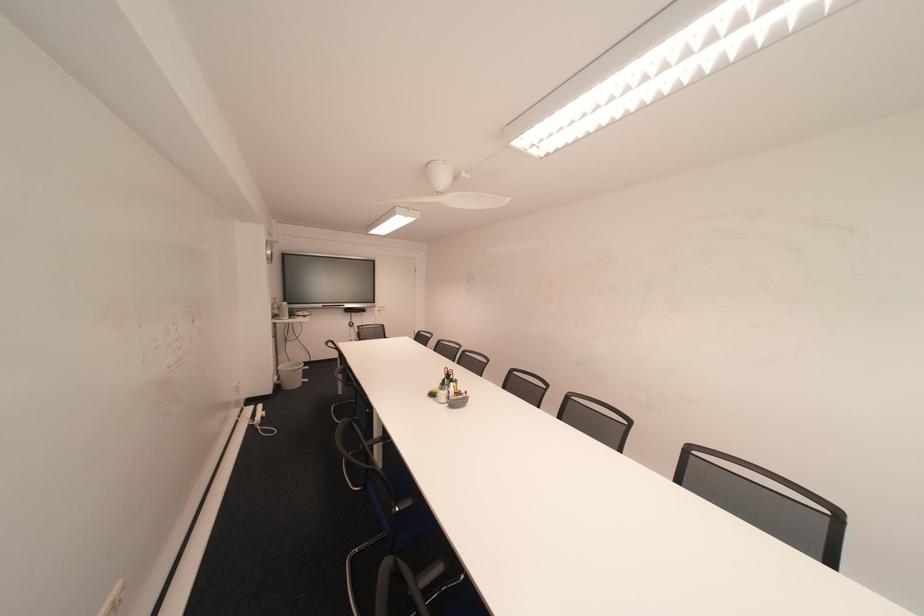
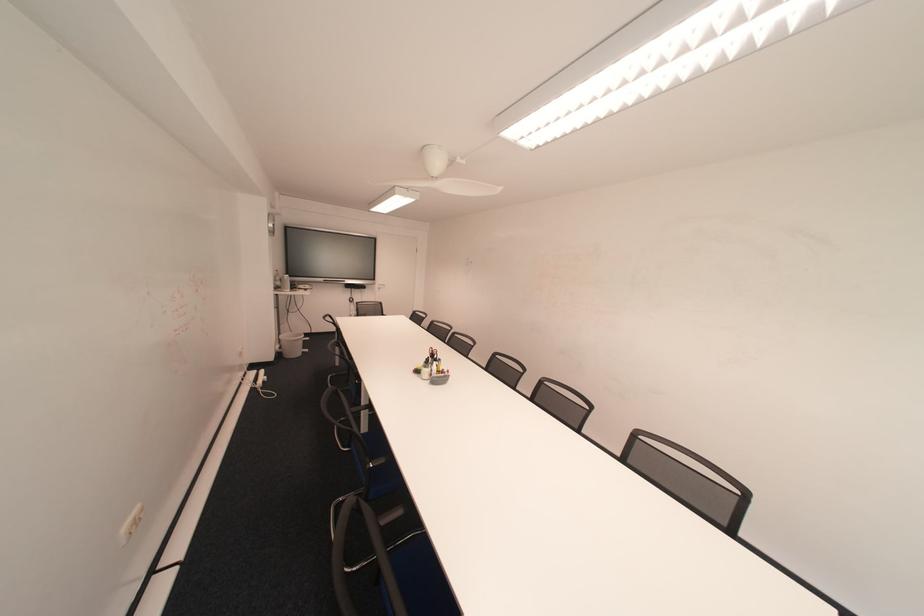
Question: Based on the continuous images, in which direction is the camera rotating? Reply with the corresponding letter.

Choices:
 (A) Left
 (B) Right
 (C) Up
 (D) Down

Answer: (D)